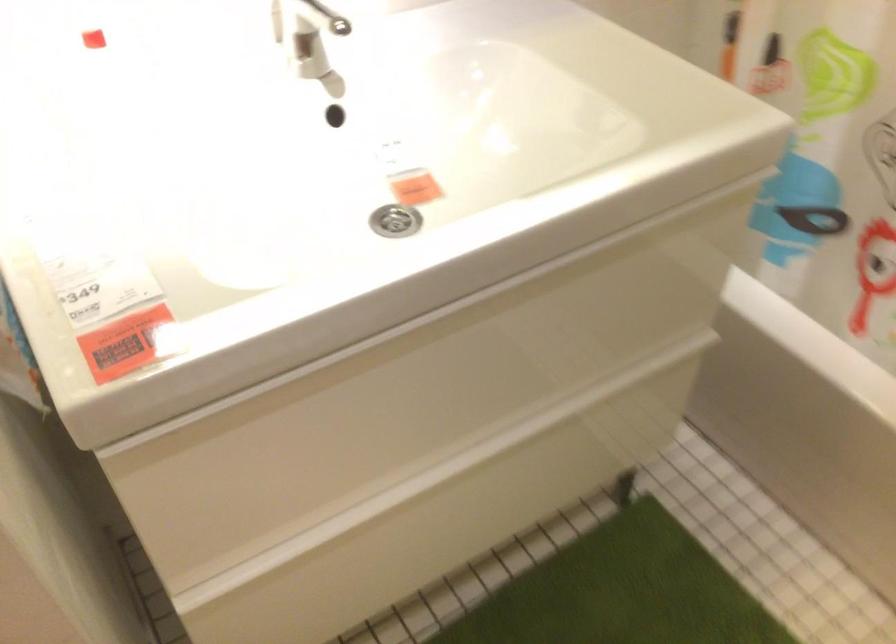
This screenshot has height=644, width=896. What do you see at coordinates (442, 514) in the screenshot? I see `the bottom drawer front` at bounding box center [442, 514].